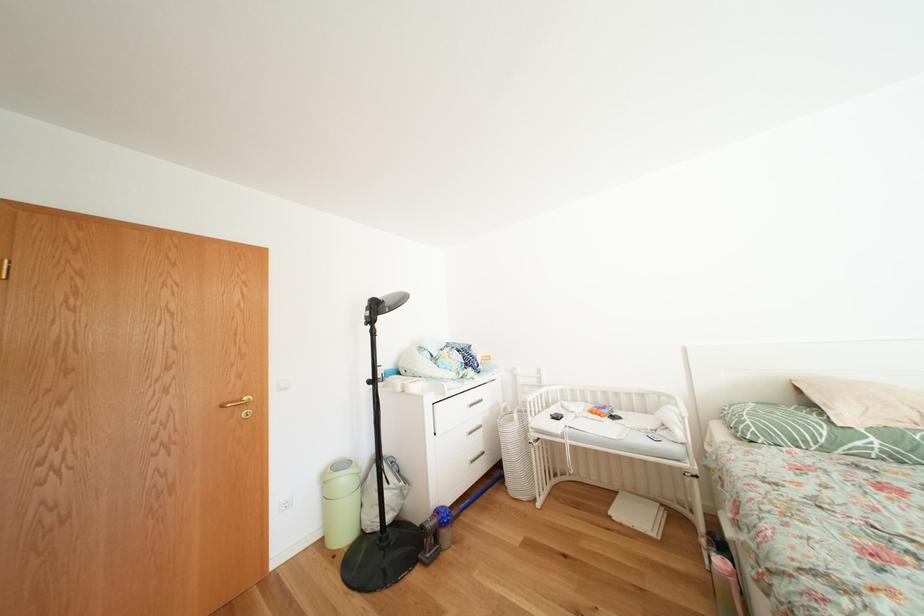
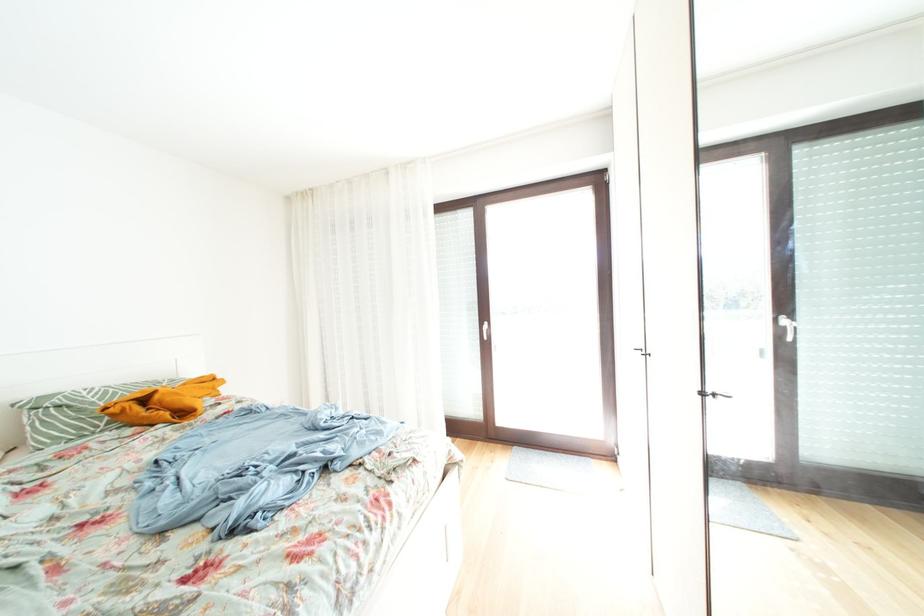
Question: The first image is from the beginning of the video and the second image is from the end. How did the camera likely rotate when shooting the video?

Choices:
 (A) Left
 (B) Right
 (C) Up
 (D) Down

Answer: (B)